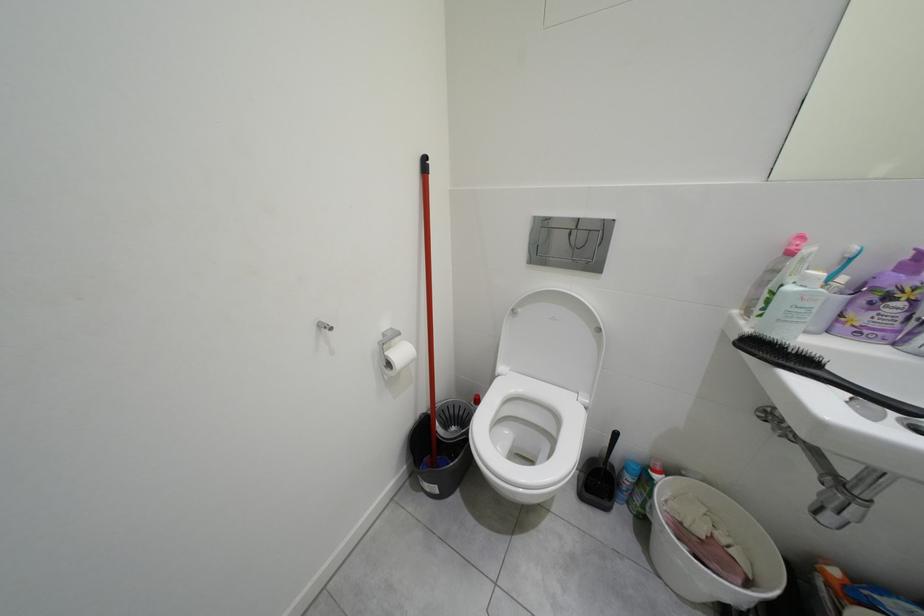
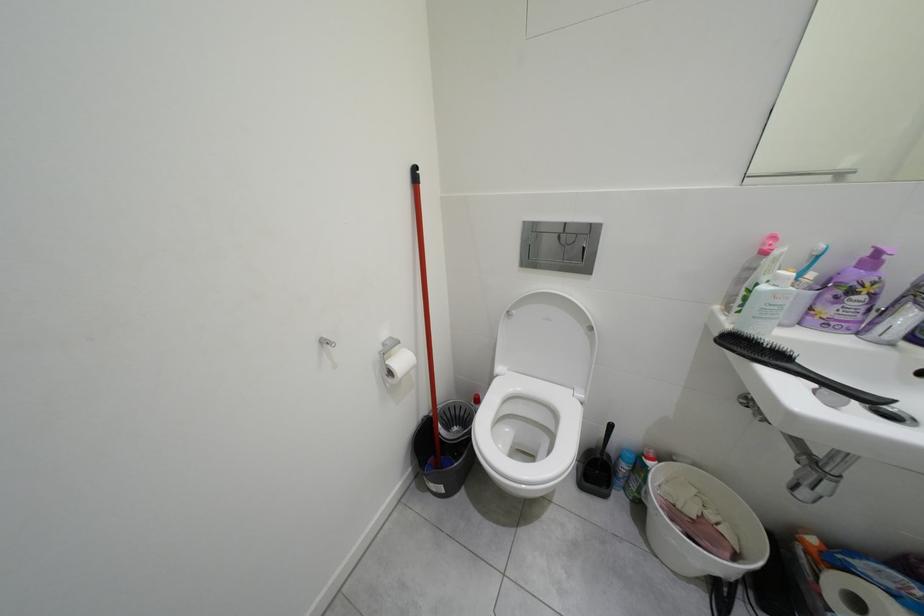
Which direction would the cameraman need to move to produce the second image?

The cameraman moved toward left, backward.